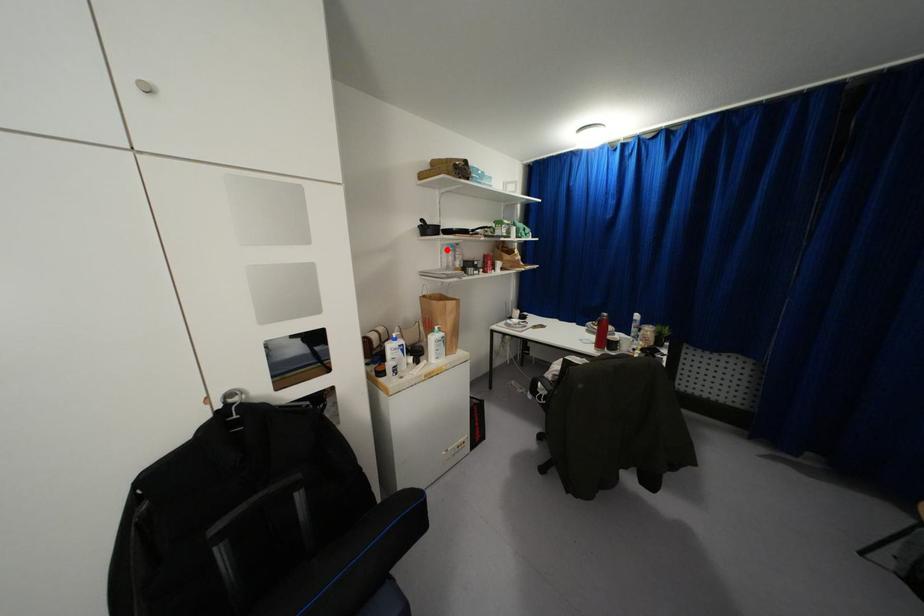
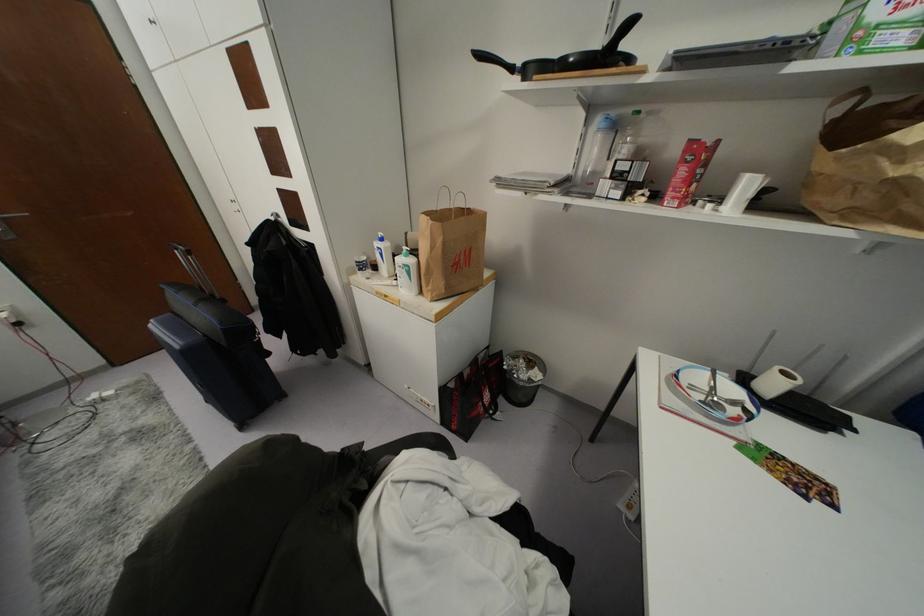
Find the pixel in the second image that matches the highlighted location in the first image.

(599, 130)